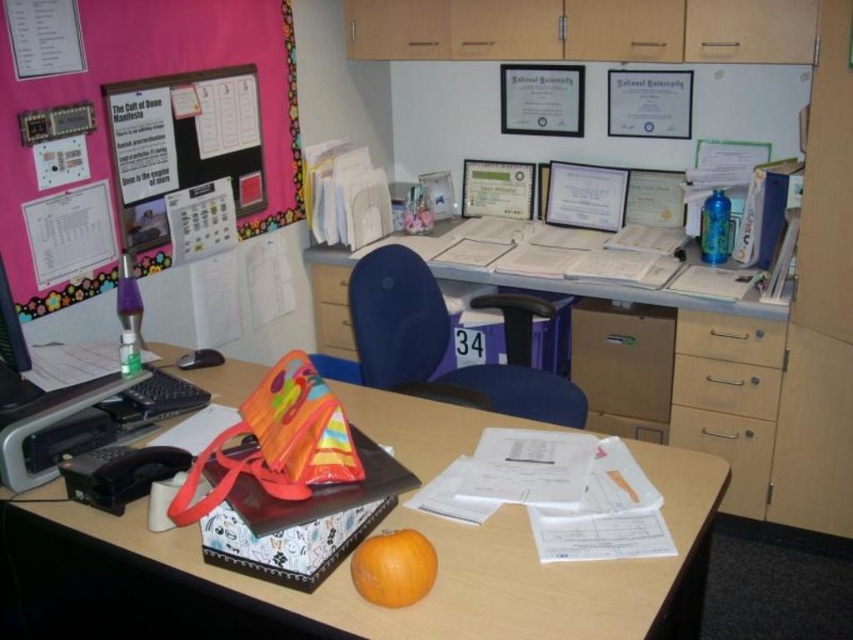
You are sitting in the blue fabric swivel chair at center in the office. You want to pick up the orange matte at center without moving from your seat. Is it possible to reach it while staying seated?

The orange matte at center is behind the blue fabric swivel chair at center, so you cannot reach it without moving from your seat.